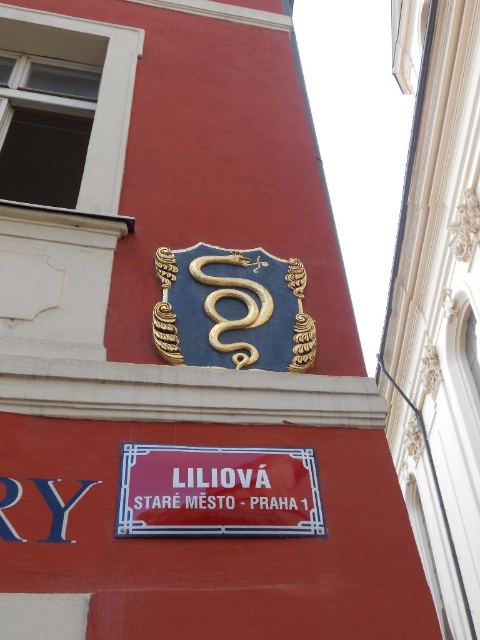
You are standing 15 feet away from the building wall. You want to touch the gold metallic snake at center with a 5.5 feet long pole. Can you reach it?

The gold metallic snake at center is 10.37 feet away from the camera. Since you are standing 15 feet away from the building wall, the total distance from you to the snake is 15 feet plus the distance from the wall to the snake. However, the given distance of 10.37 feet is likely the distance from the camera to the snake, not from the wall. Without knowing the distance from the wall to the snake, it is impossible to determine if the 5.5 feet pole is sufficient. Please provide the distance from the wall to th

You are an architect reviewing the building facade. You notice two gold snakes on the emblem. The first is the gold metallic snake at center, and the second is the gold textured snake at upper center. Which one is positioned higher on the wall?

The gold textured snake at upper center is positioned higher on the wall than the gold metallic snake at center.